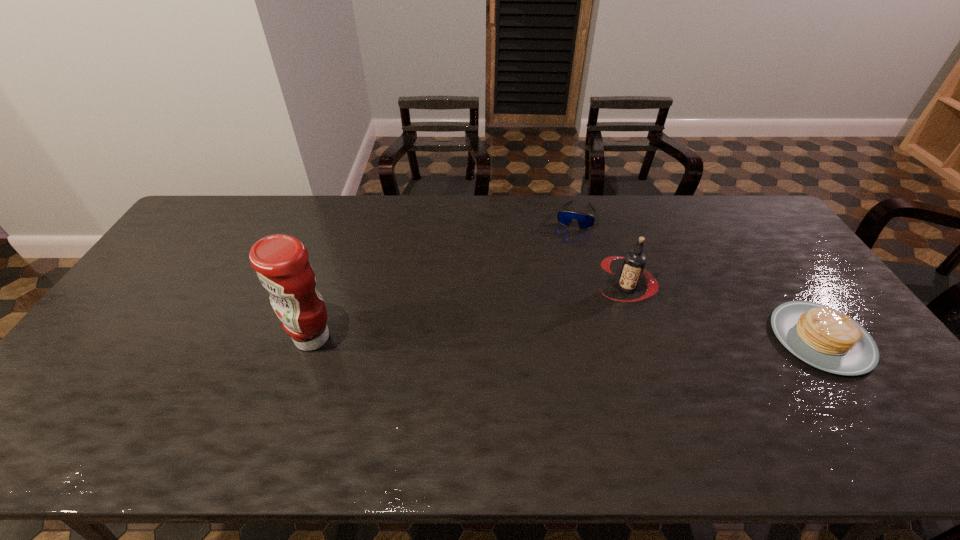
You are a GUI agent. You are given a task and a screenshot of the screen. Output one action in this format:
    pyautogui.click(x=<x>, y=<y>)
    Task: Click on the free region located on the front-facing side of the farthest object
    
    Given the screenshot: What is the action you would take?
    pyautogui.click(x=561, y=273)

The image size is (960, 540). In order to click on free space located on the front-facing side of the farthest object in this screenshot , I will do `click(564, 257)`.

The height and width of the screenshot is (540, 960). I want to click on vacant space positioned on the front-facing side of the farthest object, so click(566, 249).

Identify the location of object positioned at the far edge. Image resolution: width=960 pixels, height=540 pixels. (585, 220).

In order to click on object located in the near edge section of the desktop in this screenshot , I will do `click(825, 338)`.

At what (x,y) coordinates should I click in order to perform the action: click on object situated at the right edge. Please return your answer as a coordinate pair (x, y). This screenshot has width=960, height=540. Looking at the image, I should click on (825, 338).

Locate an element on the screen. The width and height of the screenshot is (960, 540). object that is at the near right corner is located at coordinates (825, 338).

Locate an element on the screen. vacant space at the far edge of the desktop is located at coordinates (658, 197).

Where is `vacant space at the near edge of the desktop`? vacant space at the near edge of the desktop is located at coordinates (142, 389).

The image size is (960, 540). In the image, there is a desktop. Identify the location of free space at the left edge. 164,253.